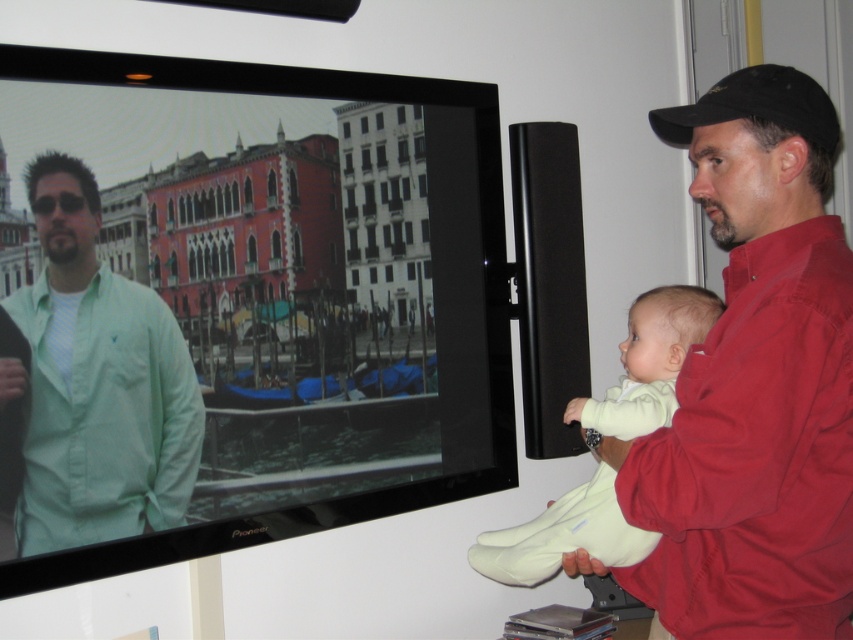
Looking at this image, does matte black television at upper left have a lesser height compared to red cotton shirt at right?

Incorrect, matte black television at upper left's height does not fall short of red cotton shirt at right's.

Which is in front, point (15, 220) or point (802, 195)?

Point (802, 195)

The image size is (853, 640). In order to click on matte black television at upper left in this screenshot , I will do `click(236, 307)`.

Can you confirm if matte black television at upper left is smaller than light yellow fabric baby at right?

No, matte black television at upper left is not smaller than light yellow fabric baby at right.

Locate an element on the screen. This screenshot has height=640, width=853. matte black television at upper left is located at coordinates (236, 307).

Does point (744, 346) come closer to viewer compared to point (54, 492)?

Yes.

Who is positioned more to the left, red cotton shirt at right or green cotton shirt at left?

green cotton shirt at left

Is point (721, 426) positioned behind point (51, 298)?

No.

Identify the location of red cotton shirt at right. The image size is (853, 640). (755, 384).